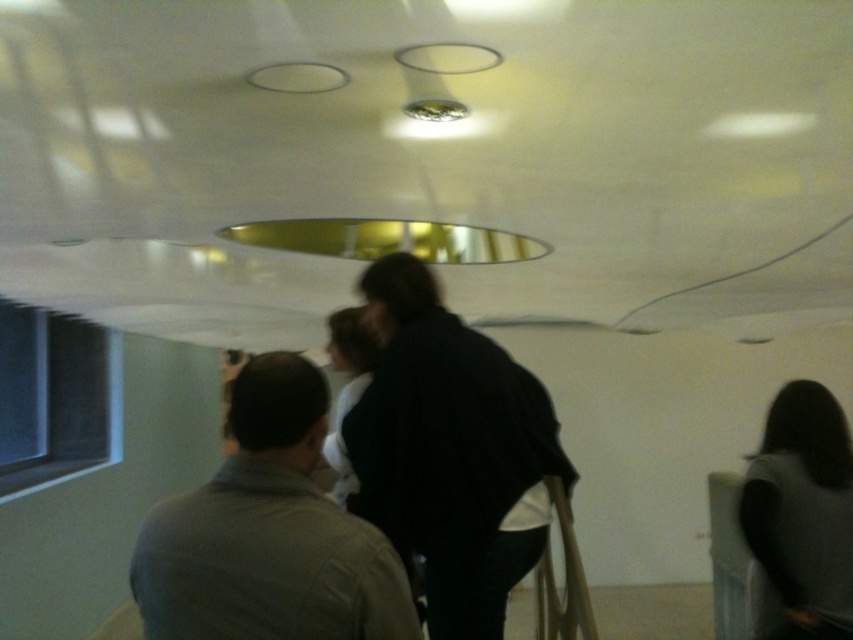
Does black matte jacket at center have a smaller size compared to dark gray fabric at lower right?

No, black matte jacket at center is not smaller than dark gray fabric at lower right.

Who is shorter, black matte jacket at center or dark gray fabric at lower right?

Standing shorter between the two is dark gray fabric at lower right.

Image resolution: width=853 pixels, height=640 pixels. I want to click on black matte jacket at center, so click(x=448, y=449).

Is gray cotton shirt at center shorter than dark gray fabric at lower right?

Correct, gray cotton shirt at center is not as tall as dark gray fabric at lower right.

Who is taller, gray cotton shirt at center or dark gray fabric at lower right?

dark gray fabric at lower right

Where is `gray cotton shirt at center`? gray cotton shirt at center is located at coordinates (268, 532).

From the picture: Can you confirm if black matte jacket at center is positioned below gray cotton shirt at center?

Actually, black matte jacket at center is above gray cotton shirt at center.

Is black matte jacket at center above gray cotton shirt at center?

Yes, black matte jacket at center is above gray cotton shirt at center.

Between point (440, 461) and point (268, 364), which one is positioned behind?

Point (440, 461)

Image resolution: width=853 pixels, height=640 pixels. In order to click on black matte jacket at center in this screenshot , I will do `click(448, 449)`.